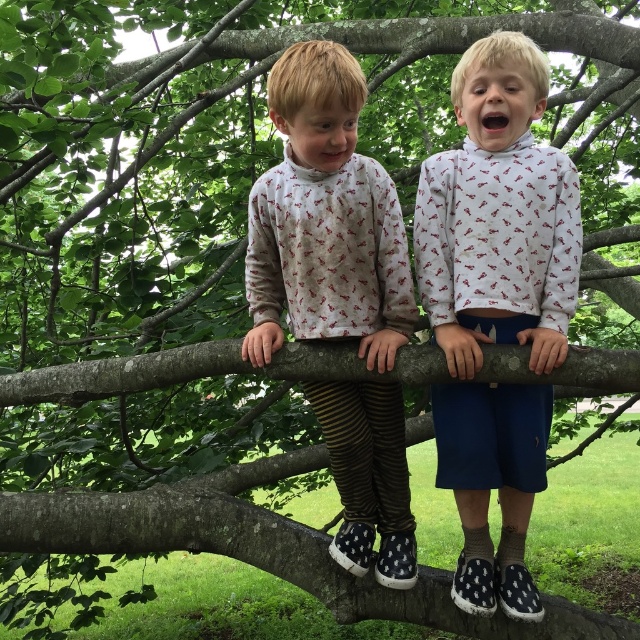
Question: Which object is the farthest from the striped leggings at center?

Choices:
 (A) smooth bark tree limb at center
 (B) white printed sweatshirt at center

Answer: (A)

Question: Does striped leggings at center have a greater width compared to smooth bark tree limb at center?

Choices:
 (A) no
 (B) yes

Answer: (A)

Question: Which object is farther from the camera taking this photo?

Choices:
 (A) white printed sweatshirt at center
 (B) striped leggings at center
 (C) smooth bark tree limb at center

Answer: (C)

Question: Does white printed sweatshirt at center appear on the left side of smooth bark tree limb at center?

Choices:
 (A) no
 (B) yes

Answer: (A)

Question: Is white printed sweatshirt at center above striped leggings at center?

Choices:
 (A) no
 (B) yes

Answer: (A)

Question: Which point appears closest to the camera in this image?

Choices:
 (A) (513, 449)
 (B) (541, 381)
 (C) (340, 458)

Answer: (B)